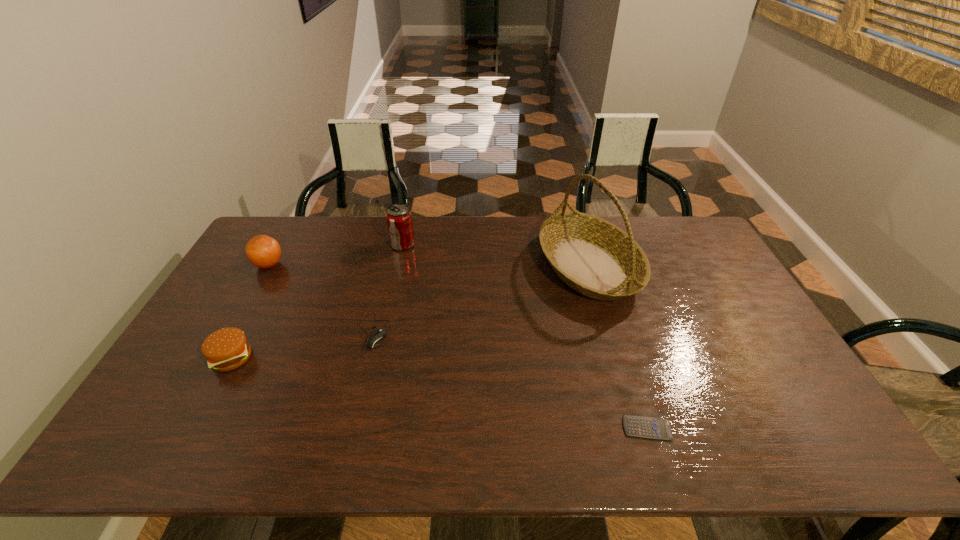
Identify the location of basket. (594, 257).

At what (x,y) coordinates should I click in order to perform the action: click on the second tallest object. Please return your answer as a coordinate pair (x, y). Looking at the image, I should click on (399, 220).

Image resolution: width=960 pixels, height=540 pixels. What are the coordinates of `orange` in the screenshot? It's located at (264, 252).

I want to click on the third shortest object, so click(x=226, y=349).

Image resolution: width=960 pixels, height=540 pixels. Identify the location of computer mouse. (377, 335).

Where is `calculator`? calculator is located at coordinates (645, 427).

Where is `the nearest object`? the nearest object is located at coordinates (645, 427).

Locate an element on the screen. free space located on the left of the basket is located at coordinates (492, 266).

Where is `vacant space located 0.220m on the front of the second tallest object`? vacant space located 0.220m on the front of the second tallest object is located at coordinates (392, 295).

At what (x,y) coordinates should I click in order to perform the action: click on free region located on the front of the orange. Please return your answer as a coordinate pair (x, y). Image resolution: width=960 pixels, height=540 pixels. Looking at the image, I should click on (229, 334).